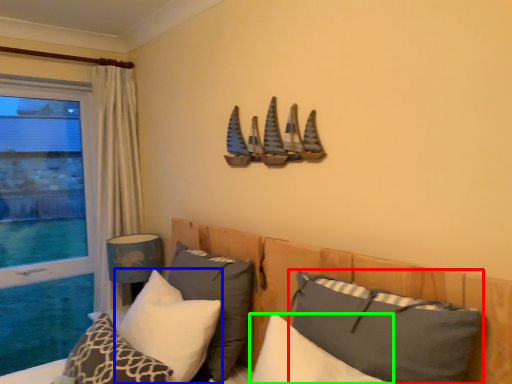
Question: Which object is positioned closest to pillow (highlighted by a red box)? Select from pillow (highlighted by a blue box) and pillow (highlighted by a green box).

Choices:
 (A) pillow
 (B) pillow

Answer: (B)